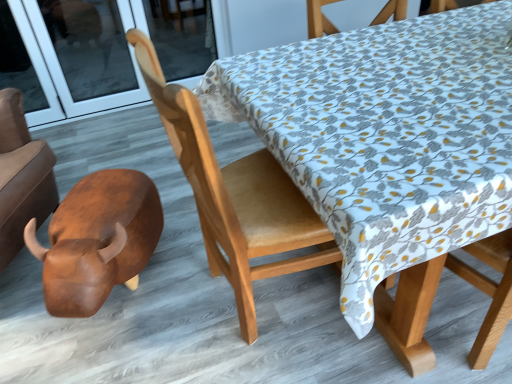
Question: Considering the relative sizes of transparent glass door at upper left and brown polished wood bull at lower left in the image provided, is transparent glass door at upper left smaller than brown polished wood bull at lower left?

Choices:
 (A) yes
 (B) no

Answer: (A)

Question: From a real-world perspective, is transparent glass door at upper left physically above brown polished wood bull at lower left?

Choices:
 (A) yes
 (B) no

Answer: (A)

Question: Does transparent glass door at upper left turn towards brown polished wood bull at lower left?

Choices:
 (A) yes
 (B) no

Answer: (A)

Question: From the image's perspective, is transparent glass door at upper left above brown polished wood bull at lower left?

Choices:
 (A) no
 (B) yes

Answer: (B)

Question: Is transparent glass door at upper left touching brown polished wood bull at lower left?

Choices:
 (A) yes
 (B) no

Answer: (B)

Question: Would you say light brown wood chair at center is inside or outside transparent glass door at upper left?

Choices:
 (A) inside
 (B) outside

Answer: (B)

Question: In terms of height, does light brown wood chair at center look taller or shorter compared to transparent glass door at upper left?

Choices:
 (A) tall
 (B) short

Answer: (A)

Question: From the image's perspective, relative to transparent glass door at upper left, is light brown wood chair at center above or below?

Choices:
 (A) above
 (B) below

Answer: (B)

Question: Is light brown wood chair at center in front of or behind transparent glass door at upper left in the image?

Choices:
 (A) front
 (B) behind

Answer: (A)

Question: Is transparent glass door at upper left situated inside light brown wood chair at center or outside?

Choices:
 (A) inside
 (B) outside

Answer: (B)

Question: Looking at their shapes, would you say transparent glass door at upper left is wider or thinner than light brown wood chair at center?

Choices:
 (A) thin
 (B) wide

Answer: (A)

Question: In terms of size, does transparent glass door at upper left appear bigger or smaller than light brown wood chair at center?

Choices:
 (A) big
 (B) small

Answer: (B)

Question: Is point (81, 84) positioned closer to the camera than point (273, 249)?

Choices:
 (A) closer
 (B) farther

Answer: (B)

Question: Is light brown wood chair at center inside or outside of brown polished wood bull at lower left?

Choices:
 (A) outside
 (B) inside

Answer: (A)

Question: In the image, is light brown wood chair at center on the left side or the right side of brown polished wood bull at lower left?

Choices:
 (A) left
 (B) right

Answer: (B)